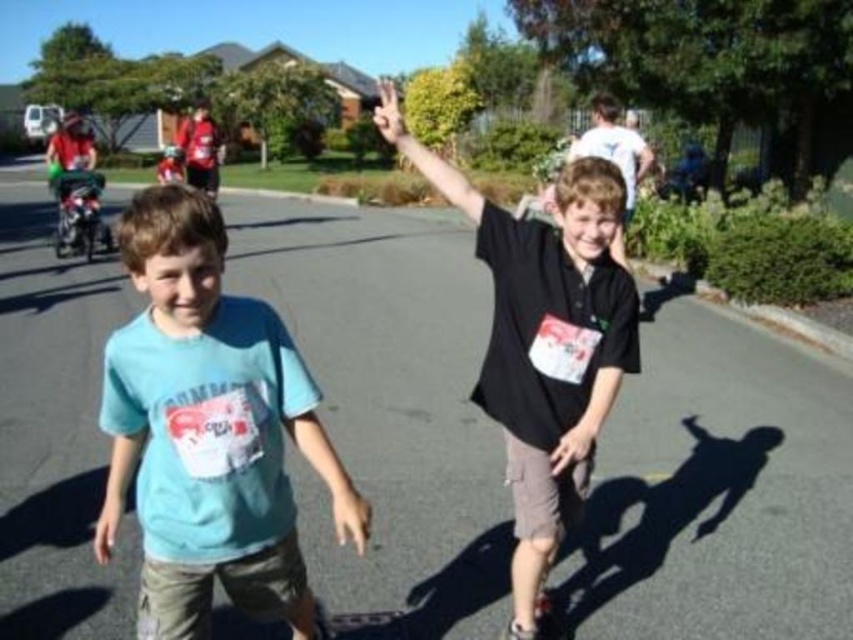
You are a photographer at the event and want to capture a photo where the light blue cotton shirt at center and the matte black hand at center are both visible. Based on their positions, which object should appear lower in the photo?

The light blue cotton shirt at center is located below the matte black hand at center, so in the photo, the light blue cotton shirt at center will appear lower than the matte black hand at center.